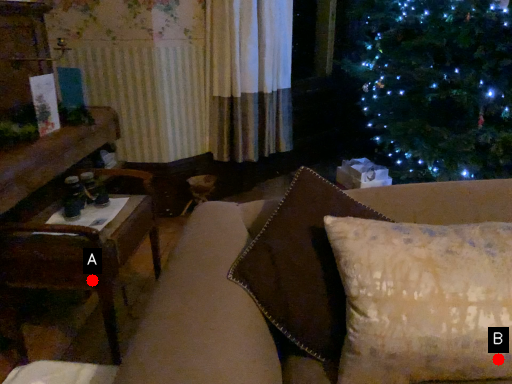
Question: Two points are circled on the image, labeled by A and B beside each circle. Which of the following is the closest to the observer?

Choices:
 (A) A is closer
 (B) B is closer

Answer: (B)